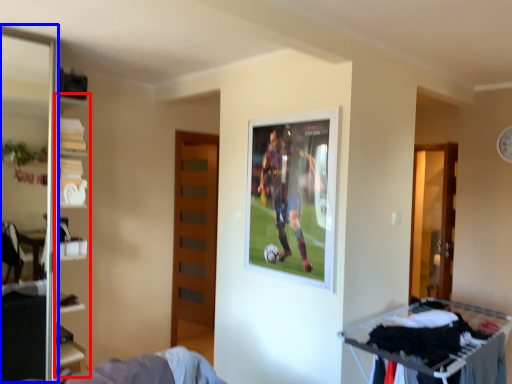
Question: Which of the following is the farthest to the observer, bookshelf (highlighted by a red box) or screen door (highlighted by a blue box)?

Choices:
 (A) bookshelf
 (B) screen door

Answer: (A)